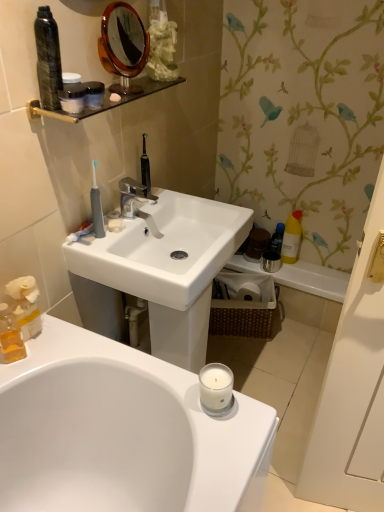
Where is `empty space that is ontop of metallic silver bath at lower right (from a real-world perspective)`? Image resolution: width=384 pixels, height=512 pixels. empty space that is ontop of metallic silver bath at lower right (from a real-world perspective) is located at coordinates (307, 269).